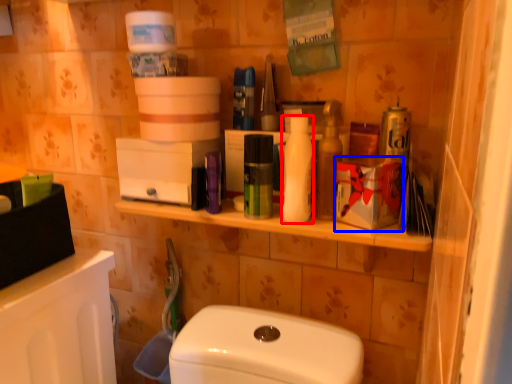
Question: Which object is closer to the camera taking this photo, toiletry (highlighted by a red box) or box (highlighted by a blue box)?

Choices:
 (A) toiletry
 (B) box

Answer: (B)